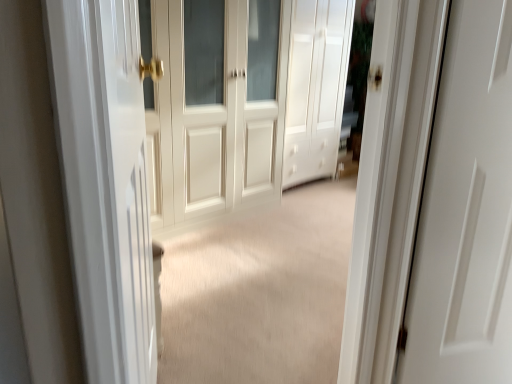
Question: Do you think white matte cabinet at center, acting as the second door starting from the left, is within white glossy door at left, or outside of it?

Choices:
 (A) inside
 (B) outside

Answer: (B)

Question: Is point (352, 11) positioned closer to the camera than point (115, 120)?

Choices:
 (A) farther
 (B) closer

Answer: (A)

Question: Estimate the real-world distances between objects in this image. Which object is closer to the white glossy door at left?

Choices:
 (A) white matte cabinet at center, acting as the second door starting from the left
 (B) white wood door at center, the 1th door when ordered from left to right

Answer: (B)

Question: Which object is positioned farthest from the white matte cabinet at center, which ranks as the 1th door in right-to-left order?

Choices:
 (A) white wood door at center, marked as the second door in a right-to-left arrangement
 (B) white glossy door at left

Answer: (B)